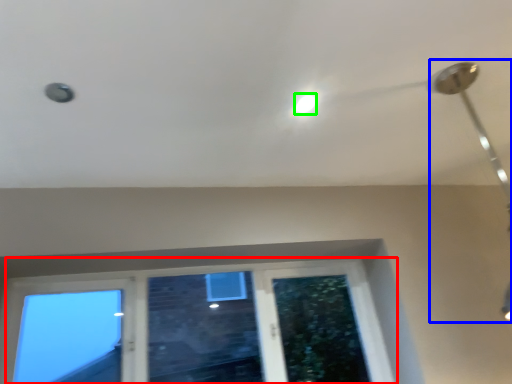
Question: Which object is the farthest from window (highlighted by a red box)? Choose among these: lamp (highlighted by a blue box) or droplight (highlighted by a green box).

Choices:
 (A) lamp
 (B) droplight

Answer: (A)